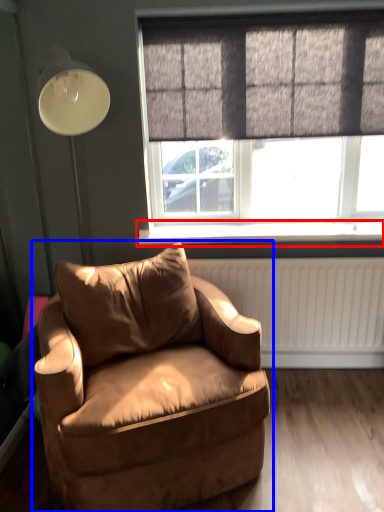
Question: Which object is closer to the camera taking this photo, window sill (highlighted by a red box) or chair (highlighted by a blue box)?

Choices:
 (A) window sill
 (B) chair

Answer: (B)